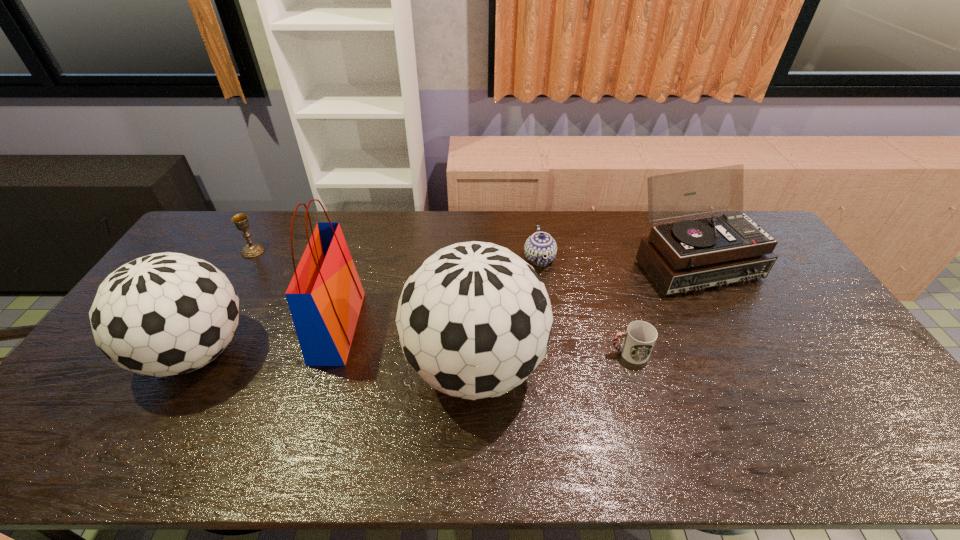
The soccer balls are evenly distributed in the image. To maintain this, where would you place another soccer ball on the right? Please point to a free space. Please provide its 2D coordinates. Your answer should be formatted as a tuple, i.e. [(x, y)], where the tuple contains the x and y coordinates of a point satisfying the conditions above.

[(770, 381)]